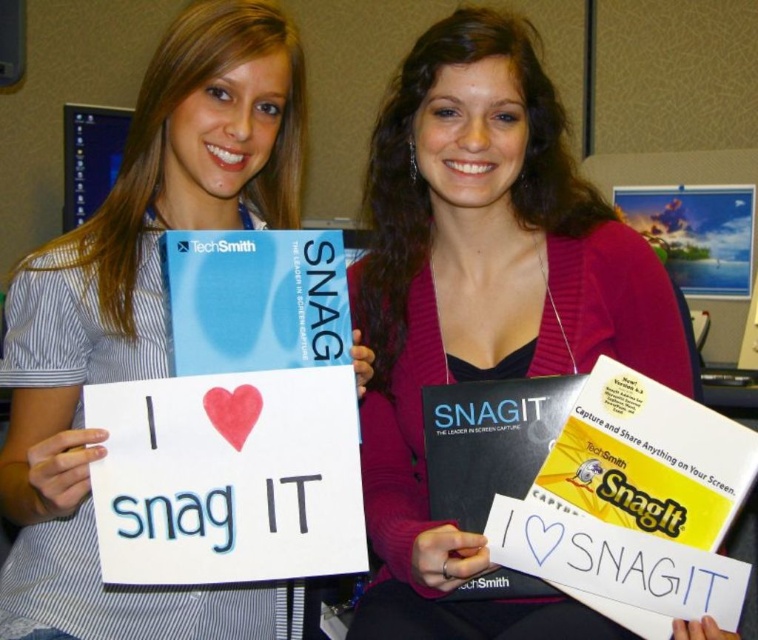
From the picture: You are organizing a bookshelf and need to place both the matte black book at center and the white paper sign at center horizontally. Given that the shelf space is exactly the width of the wider object, which object should you place first to ensure both fit without overlapping?

The matte black book at center has a larger width than the white paper sign at center. Therefore, place the matte black book at center first to ensure it fits within the shelf space, then position the white paper sign at center alongside it without overlapping.

Looking at this image, you are organizing a bookshelf and have two books in front of you. The first is a matte black book at center and the second is a black matte book at center. Which book should you place on the lower shelf if you want the larger one to be more visible on the higher shelf?

You should place the smaller black matte book at center on the lower shelf and the larger matte black book at center on the higher shelf to make the larger one more visible.

You are a delivery person who needs to place a matte black book at center on a shelf that is 28 inches away from you. Can you reach the shelf without moving closer?

The matte black book at center and viewer are 31.24 inches apart, so the shelf is 31.24 inches away from you. Since the shelf is 28 inches away, you are currently 3.24 inches too far to reach it without moving closer.